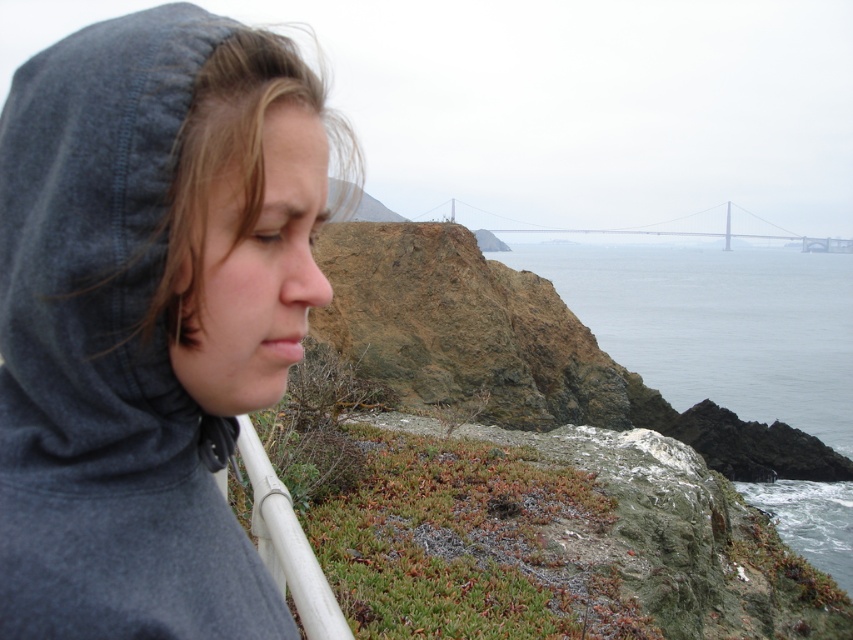
At what (x,y) coordinates should I click in order to perform the action: click on gray/rocky water at upper right. Please return your answer as a coordinate pair (x, y). Looking at the image, I should click on (717, 324).

Who is more forward, [808,394] or [573,232]?

Point [808,394] is more forward.

Describe the element at coordinates (717, 324) in the screenshot. I see `gray/rocky water at upper right` at that location.

Locate an element on the screen. The width and height of the screenshot is (853, 640). gray/rocky water at upper right is located at coordinates pos(717,324).

Does gray fleece hoodie at center appear over gray/rocky water at upper right?

No, gray fleece hoodie at center is not above gray/rocky water at upper right.

Does gray fleece hoodie at center appear on the right side of gray/rocky water at upper right?

In fact, gray fleece hoodie at center is to the left of gray/rocky water at upper right.

Identify the location of gray fleece hoodie at center. This screenshot has width=853, height=640. (148, 317).

Which of these two, gray/rocky water at upper right or white plastic rail at lower center, stands taller?

With more height is gray/rocky water at upper right.

Identify the location of gray/rocky water at upper right. (717, 324).

Is point (811, 428) positioned after point (251, 506)?

Yes, point (811, 428) is farther from viewer.

This screenshot has height=640, width=853. Identify the location of gray/rocky water at upper right. (717, 324).